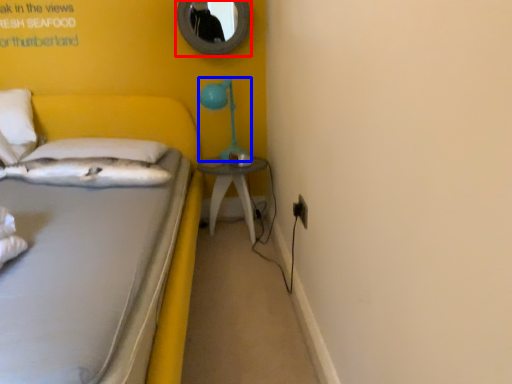
Question: Which point is closer to the camera, mirror (highlighted by a red box) or table lamp (highlighted by a blue box)?

Choices:
 (A) mirror
 (B) table lamp

Answer: (B)